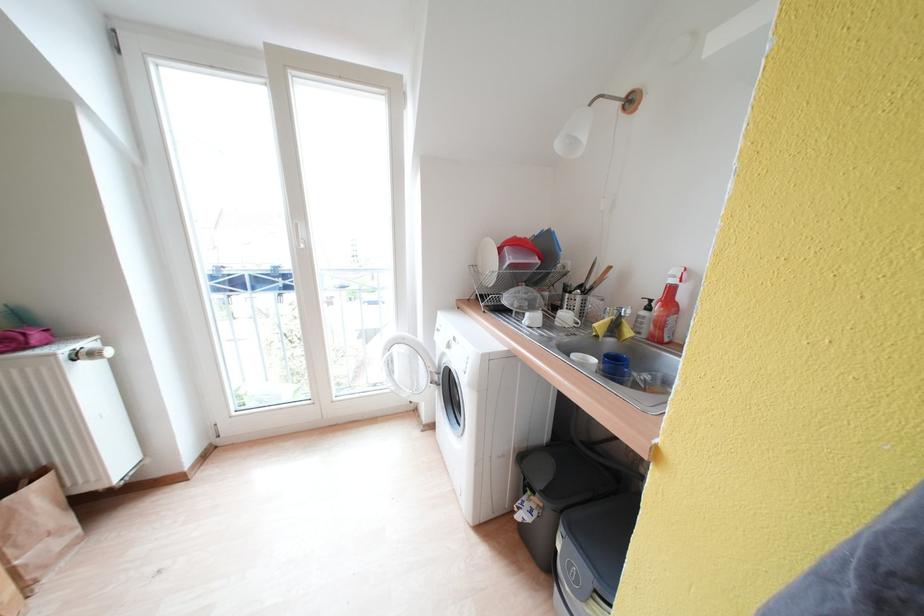
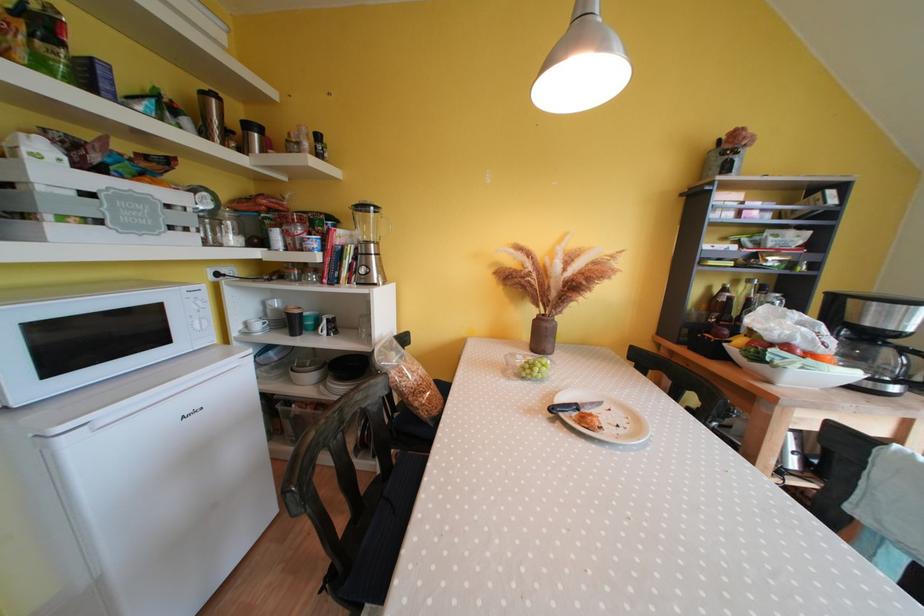
Based on the continuous images, in which direction is the camera rotating?

The rotation direction of the camera is left-down.